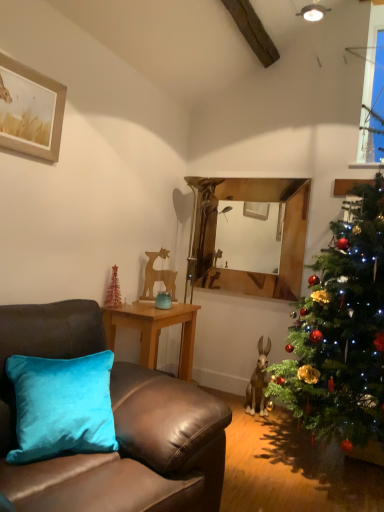
Question: From the image's perspective, is metallic gold christmas tree at lower left beneath velvet brown couch at left?

Choices:
 (A) no
 (B) yes

Answer: (A)

Question: Is metallic gold christmas tree at lower left completely or partially outside of velvet brown couch at left?

Choices:
 (A) yes
 (B) no

Answer: (A)

Question: From a real-world perspective, is metallic gold christmas tree at lower left on top of velvet brown couch at left?

Choices:
 (A) no
 (B) yes

Answer: (B)

Question: Would you say metallic gold christmas tree at lower left is a long distance from velvet brown couch at left?

Choices:
 (A) no
 (B) yes

Answer: (B)

Question: Does metallic gold christmas tree at lower left turn towards velvet brown couch at left?

Choices:
 (A) yes
 (B) no

Answer: (B)

Question: Can you confirm if metallic gold christmas tree at lower left is taller than velvet brown couch at left?

Choices:
 (A) no
 (B) yes

Answer: (A)

Question: Can you confirm if woodenobject at center is smaller than teal velvet vase at center?

Choices:
 (A) yes
 (B) no

Answer: (B)

Question: Can you confirm if woodenobject at center is thinner than teal velvet vase at center?

Choices:
 (A) yes
 (B) no

Answer: (B)

Question: Does woodenobject at center have a larger size compared to teal velvet vase at center?

Choices:
 (A) no
 (B) yes

Answer: (B)

Question: Is the surface of woodenobject at center in direct contact with teal velvet vase at center?

Choices:
 (A) no
 (B) yes

Answer: (A)

Question: Can you confirm if woodenobject at center is taller than teal velvet vase at center?

Choices:
 (A) no
 (B) yes

Answer: (B)

Question: From a real-world perspective, is woodenobject at center below teal velvet vase at center?

Choices:
 (A) yes
 (B) no

Answer: (A)

Question: Does metallic gold christmas tree at lower left have a smaller size compared to wooden picture frame at upper left?

Choices:
 (A) no
 (B) yes

Answer: (B)